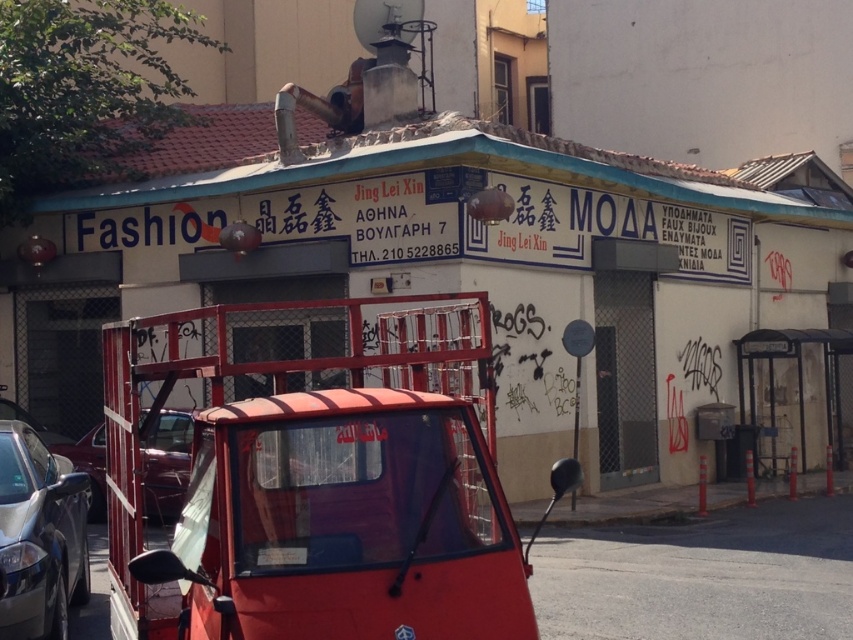
You are standing at the center of the street in front of the building. Which direction should you walk to reach the silver metallic car at lower left?

You should walk to the lower left direction to reach the silver metallic car at lower left.

You are a pedestrian standing on the sidewalk in front of the building. You want to take a photo of the white plastic license plate at center without moving any objects. Can you see the silver metallic car at lower left in the background of your photo?

Yes, because the silver metallic car at lower left is further away from you than the white plastic license plate at center, so it will appear in the background of the photo.

Looking at this image, you are a pedestrian standing on the sidewalk in front of the building. You want to take a photo of the building but need to avoid the metallic red car at lower left and the white plastic license plate at center. Which object is closer to the building so you can position yourself behind it?

The metallic red car at lower left is below the white plastic license plate at center, so the metallic red car at lower left is closer to the building. Position yourself behind the metallic red car at lower left to take the photo without obstruction.